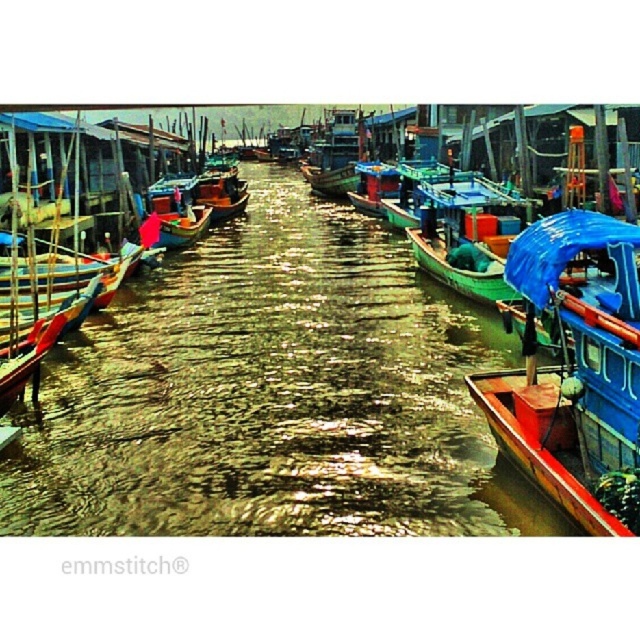
You are standing at the viewpoint of the image and want to locate two points marked in the scene. Which point is closer to you, point (486, 387) or point (188, 225)?

Point (486, 387) is in front of point (188, 225), so it is closer to you.

You are standing on the dock and see the wooden canoe at right and the green matte canoe at center. Which canoe is closer to the water surface?

The wooden canoe at right is closer to the water surface because it is positioned below the green matte canoe at center.